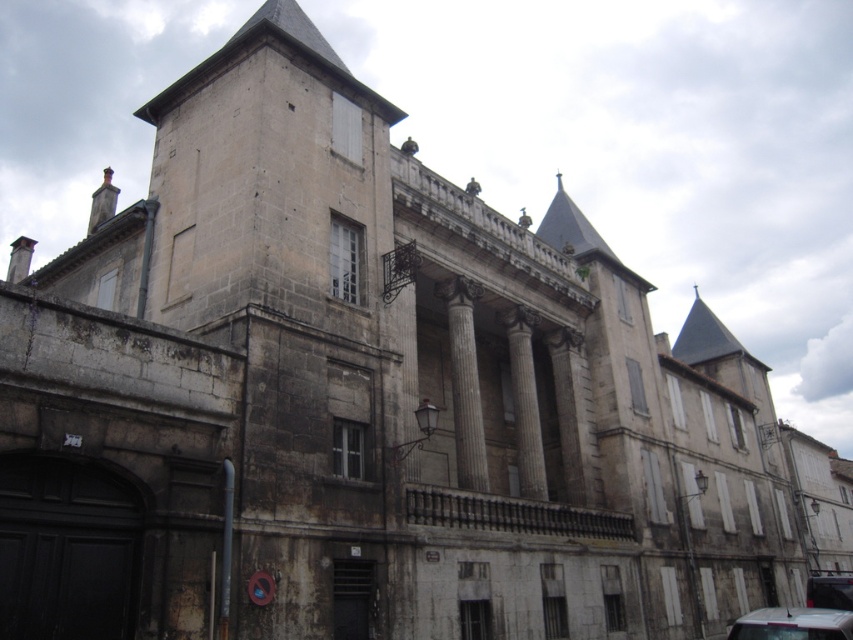
You are standing in front of the historic stone building and looking at its facade. There are two points marked on the building. One is at coordinate point [749,612] and the other is at point [840,588]. Which of these two points is closer to you?

Point [749,612] is further to the camera than point [840,588], so the point closer to you is point [840,588].

You are standing in front of the historic stone building and want to park your car. The parking spot you need is at point 0.930 on the lower right. Is the white glossy car at lower right blocking your parking spot?

The white glossy car at lower right is located at point (792, 624), which is very close to the desired parking spot at 0.930 on the lower right. Since the car is positioned near that exact point, it is likely blocking your parking spot.